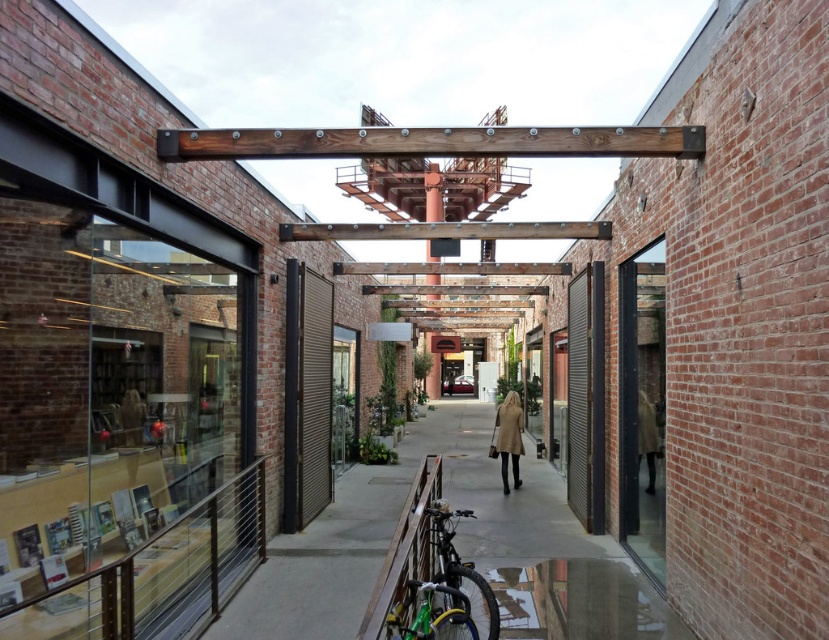
Which is behind, point (507, 410) or point (497, 422)?

The point (497, 422) is behind.

Does beige wool coat at center have a lesser height compared to matte beige trench coat at center?

No, beige wool coat at center is not shorter than matte beige trench coat at center.

Identify the location of beige wool coat at center. This screenshot has width=829, height=640. (508, 436).

Is green matte bicycle at lower center above matte beige trench coat at center?

Incorrect, green matte bicycle at lower center is not positioned above matte beige trench coat at center.

Based on the photo, does green matte bicycle at lower center have a greater width compared to matte beige trench coat at center?

Indeed, green matte bicycle at lower center has a greater width compared to matte beige trench coat at center.

Is point (415, 604) behind point (517, 428)?

No, it is in front of (517, 428).

I want to click on green matte bicycle at lower center, so [445, 592].

Can you confirm if green matte bicycle at lower center is positioned above beige wool coat at center?

Yes, green matte bicycle at lower center is above beige wool coat at center.

Between point (434, 582) and point (502, 403), which one is positioned in front?

Point (434, 582) is more forward.

At what (x,y) coordinates should I click in order to perform the action: click on green matte bicycle at lower center. Please return your answer as a coordinate pair (x, y). Looking at the image, I should click on (445, 592).